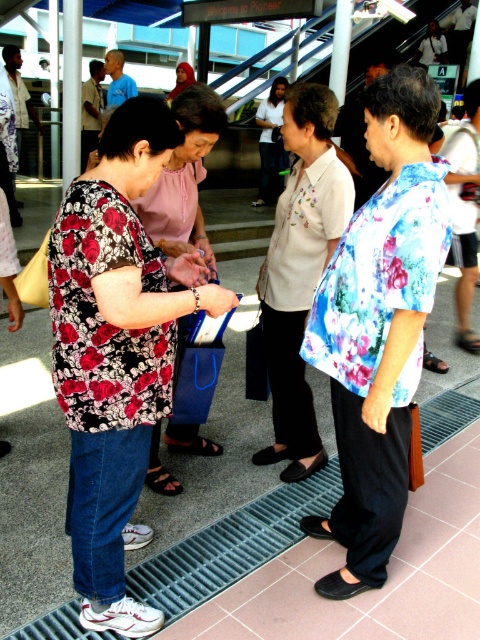
Question: Which of these objects is positioned closest to the floral-patterned shirt at center?

Choices:
 (A) floral fabric purse at center
 (B) white cotton shirt at center

Answer: (A)

Question: Is floral-patterned shirt at center above floral fabric purse at center?

Choices:
 (A) no
 (B) yes

Answer: (A)

Question: Is floral fabric purse at center wider than white cotton shirt at center?

Choices:
 (A) no
 (B) yes

Answer: (A)

Question: Which object appears closest to the camera in this image?

Choices:
 (A) floral-patterned shirt at center
 (B) white cotton shirt at center
 (C) floral fabric purse at center

Answer: (A)

Question: Does floral-patterned shirt at center have a smaller size compared to white cotton shirt at center?

Choices:
 (A) yes
 (B) no

Answer: (A)

Question: Which of these objects is positioned farthest from the white cotton shirt at center?

Choices:
 (A) floral fabric purse at center
 (B) floral-patterned shirt at center

Answer: (B)